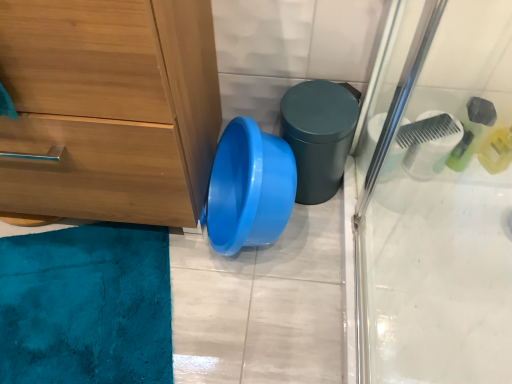
Question: From the image's perspective, is wooden chest of drawers at left positioned above or below matte green potty at center?

Choices:
 (A) above
 (B) below

Answer: (A)

Question: Considering the positions of wooden chest of drawers at left and matte green potty at center in the image, is wooden chest of drawers at left wider or thinner than matte green potty at center?

Choices:
 (A) wide
 (B) thin

Answer: (A)

Question: In terms of height, does wooden chest of drawers at left look taller or shorter compared to matte green potty at center?

Choices:
 (A) tall
 (B) short

Answer: (A)

Question: From a real-world perspective, relative to wooden chest of drawers at left, is matte green potty at center vertically above or below?

Choices:
 (A) above
 (B) below

Answer: (B)

Question: Is matte green potty at center inside the boundaries of wooden chest of drawers at left, or outside?

Choices:
 (A) outside
 (B) inside

Answer: (A)

Question: Is matte green potty at center wider or thinner than wooden chest of drawers at left?

Choices:
 (A) wide
 (B) thin

Answer: (B)

Question: Is point (355, 94) positioned closer to the camera than point (134, 170)?

Choices:
 (A) farther
 (B) closer

Answer: (A)